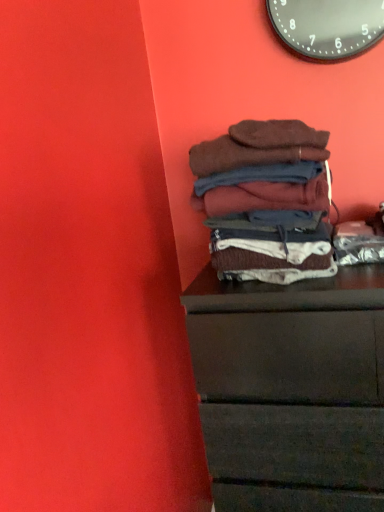
Question: Is dark wood chest of drawers at lower right at the back of black metallic clock at upper center?

Choices:
 (A) yes
 (B) no

Answer: (B)

Question: Can you confirm if black metallic clock at upper center is wider than dark wood chest of drawers at lower right?

Choices:
 (A) no
 (B) yes

Answer: (A)

Question: From the image's perspective, is black metallic clock at upper center under dark wood chest of drawers at lower right?

Choices:
 (A) yes
 (B) no

Answer: (B)

Question: Considering the relative positions of black metallic clock at upper center and dark wood chest of drawers at lower right in the image provided, is black metallic clock at upper center to the left of dark wood chest of drawers at lower right from the viewer's perspective?

Choices:
 (A) yes
 (B) no

Answer: (B)

Question: Would you say black metallic clock at upper center contains dark wood chest of drawers at lower right?

Choices:
 (A) no
 (B) yes

Answer: (A)

Question: Considering the positions of point (215, 158) and point (279, 413), is point (215, 158) closer or farther from the camera than point (279, 413)?

Choices:
 (A) closer
 (B) farther

Answer: (A)

Question: In terms of size, does brown soft fabric at center appear bigger or smaller than dark wood chest of drawers at lower right?

Choices:
 (A) big
 (B) small

Answer: (B)

Question: Is brown soft fabric at center inside the boundaries of dark wood chest of drawers at lower right, or outside?

Choices:
 (A) outside
 (B) inside

Answer: (A)

Question: From a real-world perspective, is brown soft fabric at center physically located above or below dark wood chest of drawers at lower right?

Choices:
 (A) below
 (B) above

Answer: (B)

Question: Looking at the image, does black metallic clock at upper center seem bigger or smaller compared to dark wood chest of drawers at lower right?

Choices:
 (A) big
 (B) small

Answer: (B)

Question: From the image's perspective, is black metallic clock at upper center above or below dark wood chest of drawers at lower right?

Choices:
 (A) below
 (B) above

Answer: (B)

Question: From their relative heights in the image, would you say black metallic clock at upper center is taller or shorter than dark wood chest of drawers at lower right?

Choices:
 (A) short
 (B) tall

Answer: (A)

Question: Is black metallic clock at upper center to the left or to the right of dark wood chest of drawers at lower right in the image?

Choices:
 (A) left
 (B) right

Answer: (B)

Question: Looking at their shapes, would you say dark wood chest of drawers at lower right is wider or thinner than brown soft fabric at center?

Choices:
 (A) wide
 (B) thin

Answer: (A)

Question: From a real-world perspective, is dark wood chest of drawers at lower right physically located above or below brown soft fabric at center?

Choices:
 (A) below
 (B) above

Answer: (A)